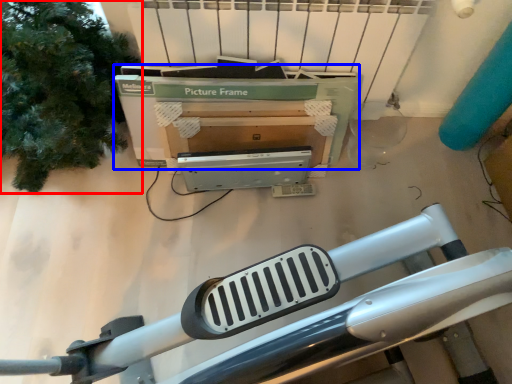
Question: Among these objects, which one is nearest to the camera, tree (highlighted by a red box) or box (highlighted by a blue box)?

Choices:
 (A) tree
 (B) box

Answer: (A)